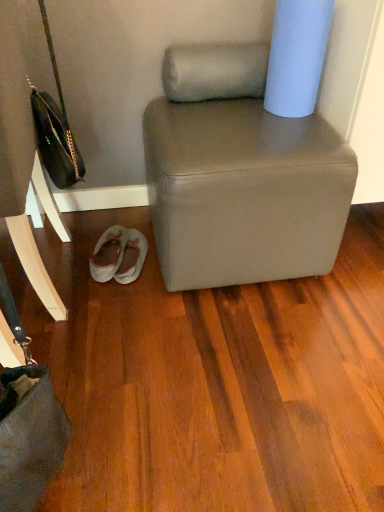
What are the coordinates of `vacant area that is in front of matte gray ottoman at center` in the screenshot? It's located at tap(230, 359).